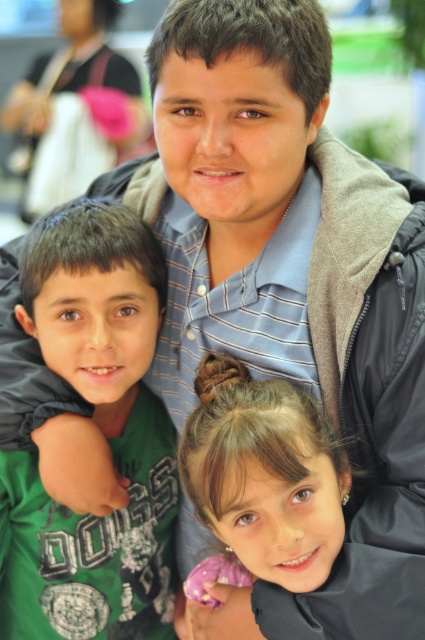
You are a photographer adjusting the focus on a camera. You notice two points in the image labeled as point (40,336) and point (201,508). Which point should you focus on to ensure the subject in the foreground is sharp?

Point (40,336) should be focused on because it is closer to the camera than point (201,508). Since the photographer wants the foreground subject sharp, focusing on the closer point ensures clarity.

Where is the green cotton shirt at center located in the image?

The green cotton shirt at center is located at point (99, 428).